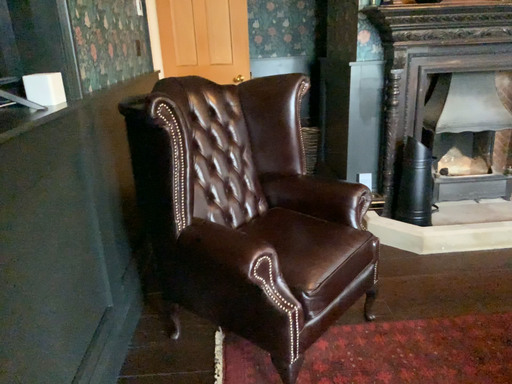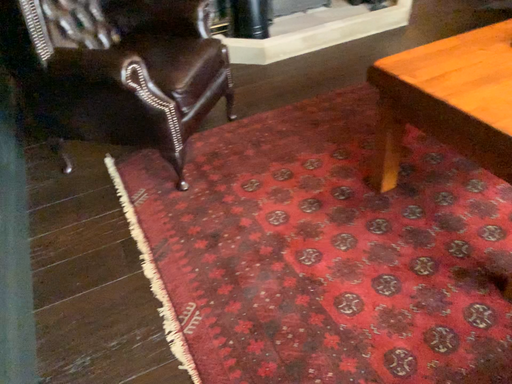
Question: How did the camera likely rotate when shooting the video?

Choices:
 (A) rotated upward
 (B) rotated downward

Answer: (B)